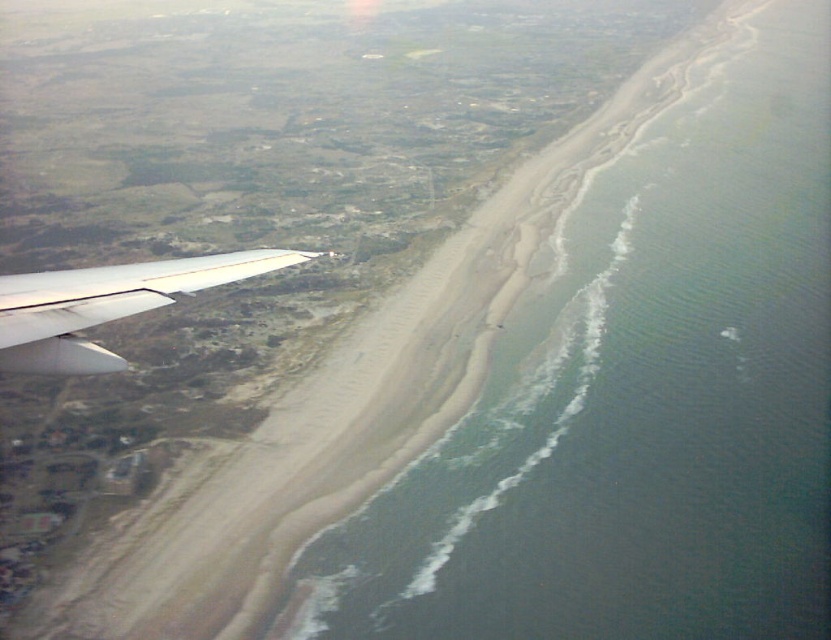
Is green water at beach right smaller than white matte wing at lower left?

No, green water at beach right is not smaller than white matte wing at lower left.

Is green water at beach right further to the viewer compared to white matte wing at lower left?

Yes, it is.

The width and height of the screenshot is (831, 640). I want to click on green water at beach right, so click(x=638, y=397).